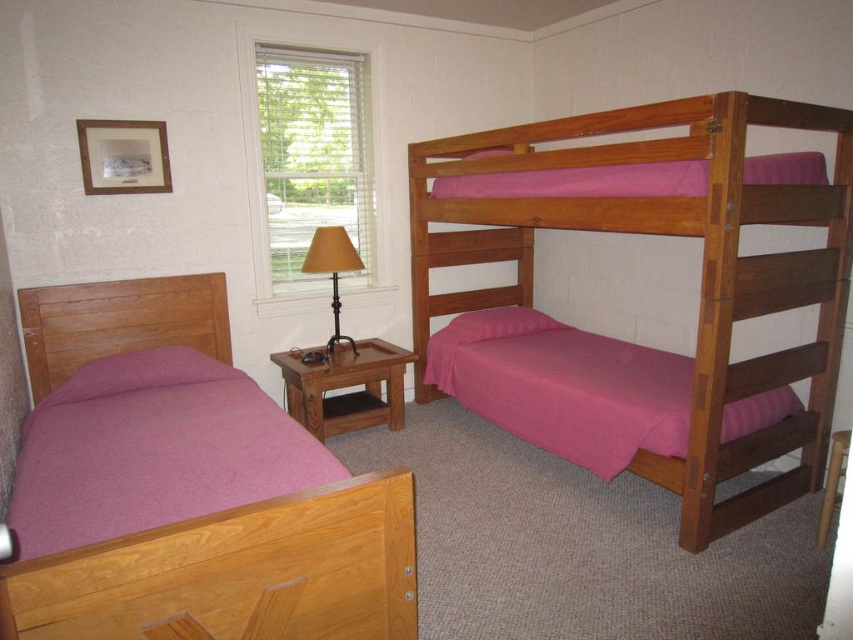
Question: Which object appears closest to the camera in this image?

Choices:
 (A) pink fabric bed at right
 (B) matte wood bed at left
 (C) matte gold lamp at center
 (D) purple cotton blanket at lower left

Answer: (D)

Question: Which of the following is the farthest from the observer?

Choices:
 (A) matte wood bed at left
 (B) matte gold lamp at center

Answer: (B)

Question: Can you confirm if wooden bunk bed at upper right is wider than matte wood bed at left?

Choices:
 (A) yes
 (B) no

Answer: (A)

Question: Can you confirm if pink fabric bed at right is bigger than matte gold lamp at center?

Choices:
 (A) no
 (B) yes

Answer: (B)

Question: Does pink fabric bed at right lie in front of matte gold lamp at center?

Choices:
 (A) no
 (B) yes

Answer: (B)

Question: Which of the following is the farthest from the observer?

Choices:
 (A) matte gold lamp at center
 (B) purple cotton blanket at lower left
 (C) pink fabric bed at right
 (D) matte wood bed at left

Answer: (A)